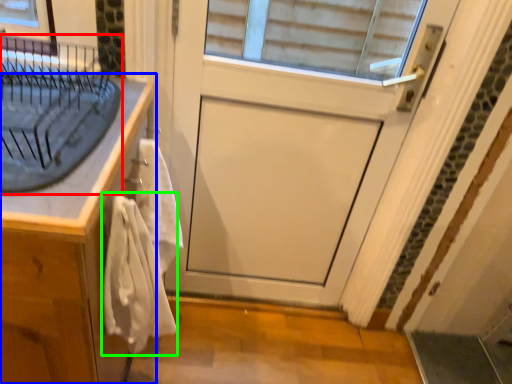
Question: Which is farther away from sink (highlighted by a red box)? cabinetry (highlighted by a blue box) or bath towel (highlighted by a green box)?

Choices:
 (A) cabinetry
 (B) bath towel

Answer: (B)